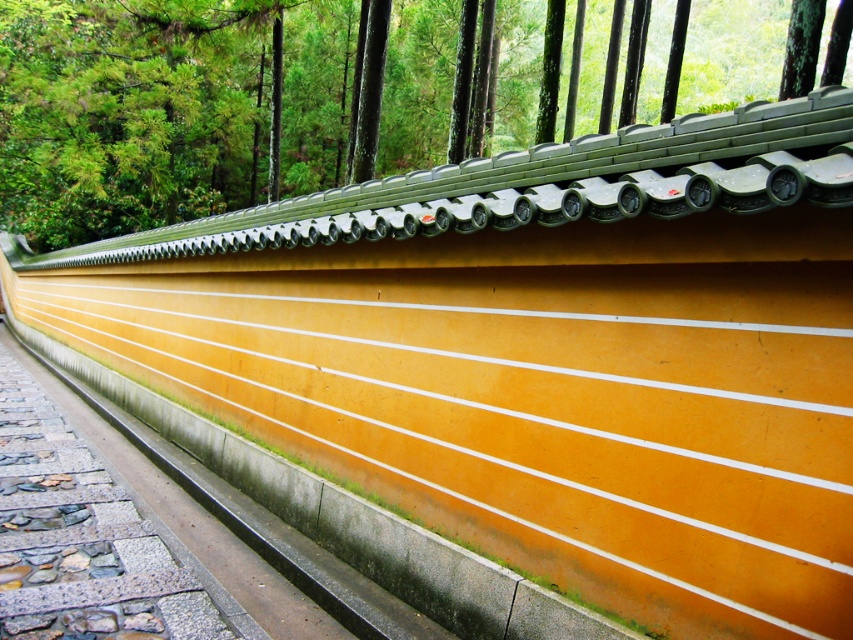
Question: Considering the relative positions of green matte roof tiles at upper center and smooth stone path at lower left in the image provided, where is green matte roof tiles at upper center located with respect to smooth stone path at lower left?

Choices:
 (A) left
 (B) right

Answer: (B)

Question: Which point appears farthest from the camera in this image?

Choices:
 (A) (181, 490)
 (B) (215, 84)

Answer: (B)

Question: Which of the following is the farthest from the observer?

Choices:
 (A) green matte roof tiles at upper center
 (B) smooth stone path at lower left

Answer: (A)

Question: Can you confirm if green matte roof tiles at upper center is smaller than smooth stone path at lower left?

Choices:
 (A) yes
 (B) no

Answer: (B)

Question: Among these objects, which one is nearest to the camera?

Choices:
 (A) smooth stone path at lower left
 (B) green matte roof tiles at upper center

Answer: (A)

Question: Does green matte roof tiles at upper center have a smaller size compared to smooth stone path at lower left?

Choices:
 (A) yes
 (B) no

Answer: (B)